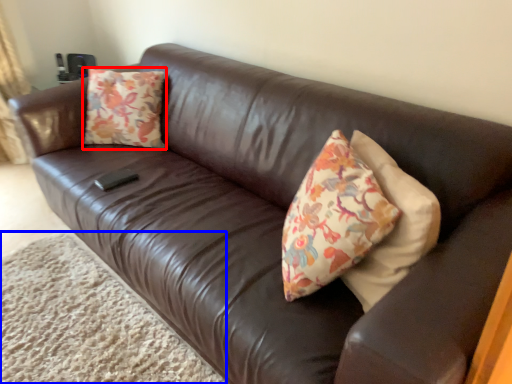
Question: Which object is further to the camera taking this photo, throw pillow (highlighted by a red box) or plain (highlighted by a blue box)?

Choices:
 (A) throw pillow
 (B) plain

Answer: (A)